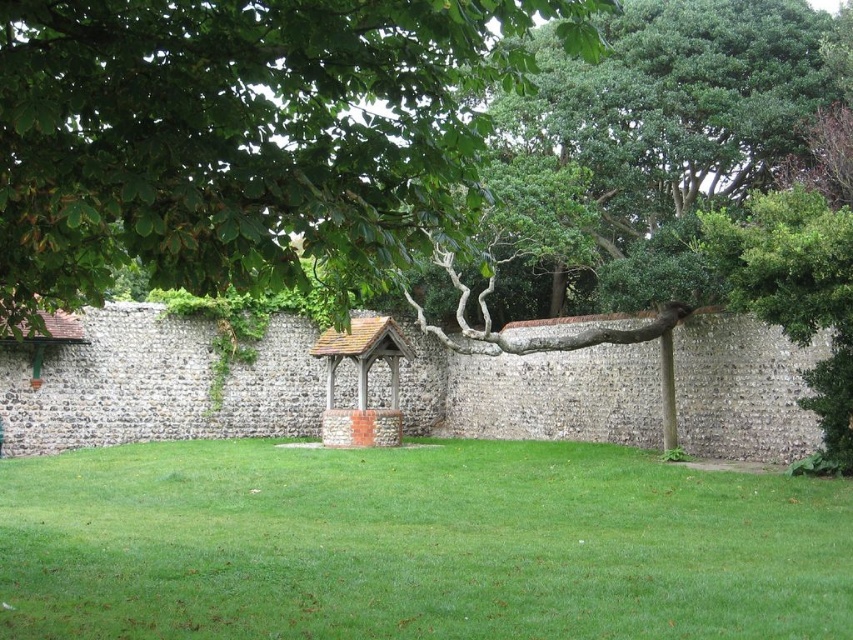
Does point (531, 490) come behind point (335, 17)?

Yes, point (531, 490) is behind point (335, 17).

Does green grass at center have a larger size compared to green leafy tree at upper left?

Incorrect, green grass at center is not larger than green leafy tree at upper left.

Is point (428, 595) less distant than point (119, 108)?

That is False.

At what (x,y) coordinates should I click in order to perform the action: click on green grass at center. Please return your answer as a coordinate pair (x, y). Looking at the image, I should click on (415, 545).